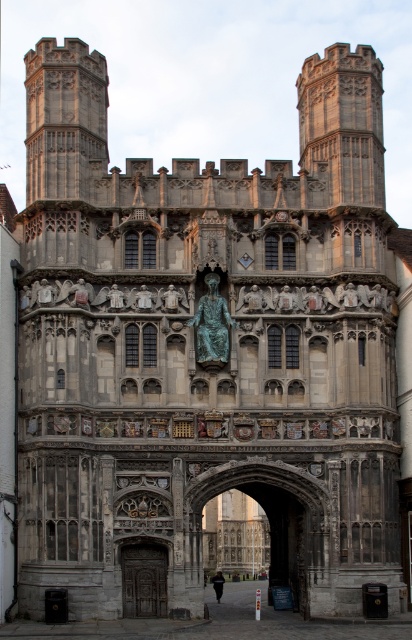
Question: Does stone archway at center have a smaller size compared to dark wood door at lower left?

Choices:
 (A) yes
 (B) no

Answer: (B)

Question: In this image, where is stone textured tower at upper left located relative to stone archway at center?

Choices:
 (A) left
 (B) right

Answer: (A)

Question: Among these objects, which one is nearest to the camera?

Choices:
 (A) green patinated bronze statue at center
 (B) dark wood door at lower left
 (C) stone archway at center
 (D) stone textured tower at upper left

Answer: (C)

Question: Can you confirm if stone textured tower at upper left is wider than green patinated bronze statue at center?

Choices:
 (A) yes
 (B) no

Answer: (A)

Question: Which object is farther from the camera taking this photo?

Choices:
 (A) stone archway at center
 (B) green patinated bronze statue at center
 (C) dark wood door at lower left

Answer: (B)

Question: Which point is farther from the camera taking this photo?

Choices:
 (A) tap(142, 573)
 (B) tap(201, 337)

Answer: (B)